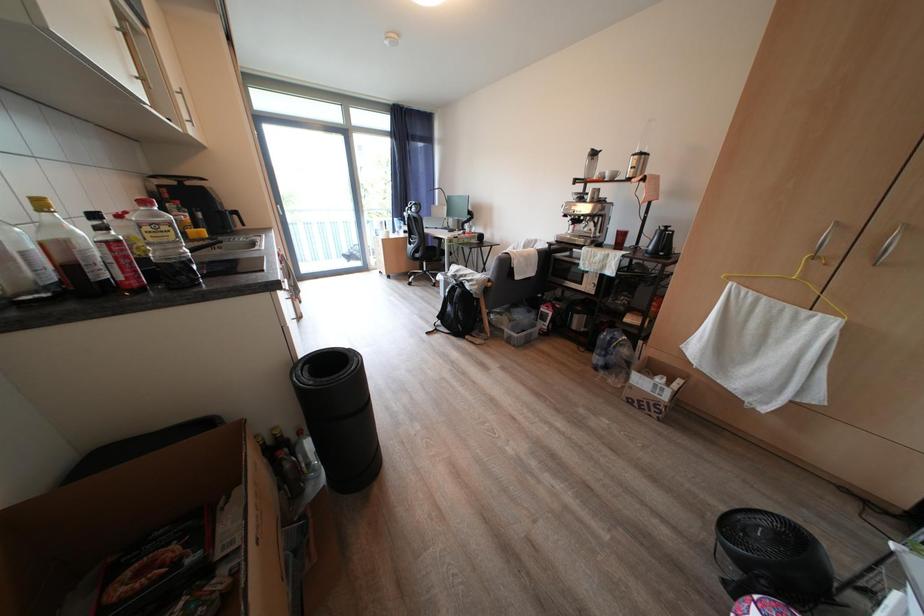
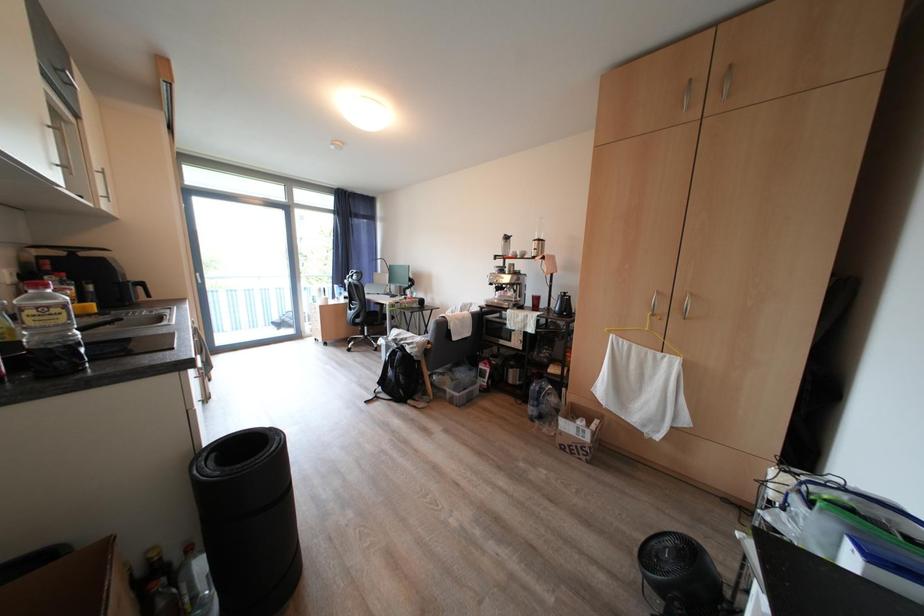
Question: How did the camera likely rotate?

Choices:
 (A) Left
 (B) Right
 (C) Up
 (D) Down

Answer: (C)